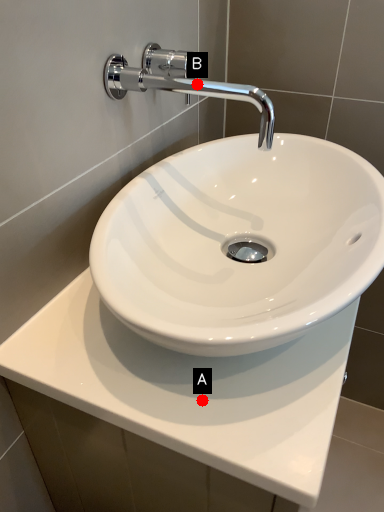
Question: Two points are circled on the image, labeled by A and B beside each circle. Which point appears closest to the camera in this image?

Choices:
 (A) A is closer
 (B) B is closer

Answer: (A)